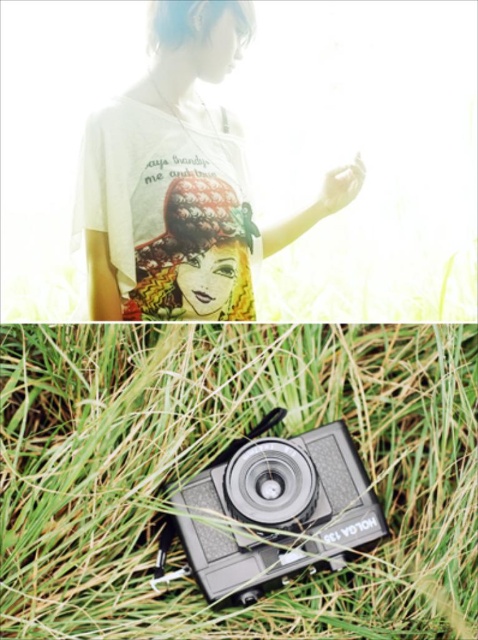
Question: Which point appears farthest from the camera in this image?

Choices:
 (A) (236, 456)
 (B) (209, 152)
 (C) (275, 483)
 (D) (350, 365)

Answer: (B)

Question: Can you confirm if matte white t-shirt at upper center is positioned to the right of matte silver lens at center?

Choices:
 (A) yes
 (B) no

Answer: (B)

Question: Which point is closer to the camera taking this photo?

Choices:
 (A) (299, 506)
 (B) (256, 465)
 (C) (15, 342)
 (D) (155, 282)

Answer: (A)

Question: Considering the relative positions of green grass at lower center and metallic silver film camera at lower center in the image provided, where is green grass at lower center located with respect to metallic silver film camera at lower center?

Choices:
 (A) above
 (B) below

Answer: (A)

Question: Which object is the farthest from the matte silver lens at center?

Choices:
 (A) green grass at lower center
 (B) matte white t-shirt at upper center
 (C) metallic silver film camera at lower center

Answer: (B)

Question: Is metallic silver film camera at lower center to the right of matte silver lens at center from the viewer's perspective?

Choices:
 (A) no
 (B) yes

Answer: (A)